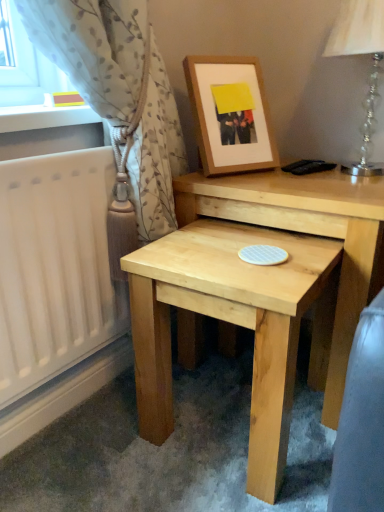
The width and height of the screenshot is (384, 512). In order to click on free space in front of clear crystal glass table lamp at upper right in this screenshot , I will do `click(340, 193)`.